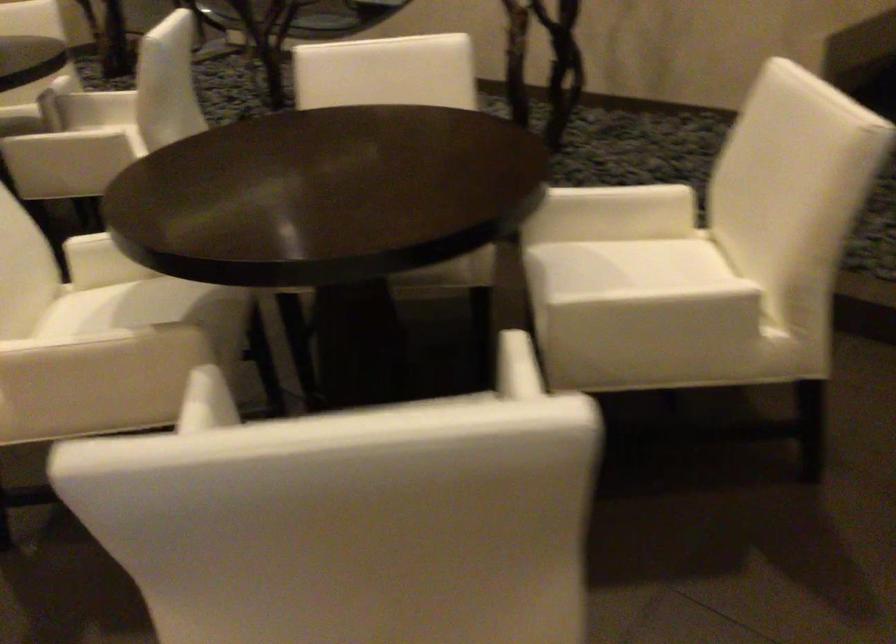
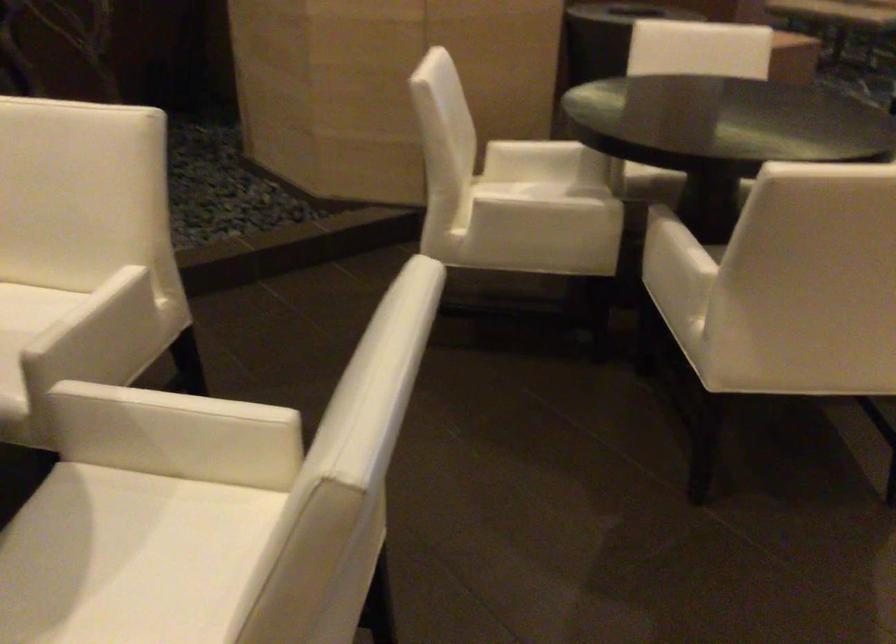
In the second image, find the point that corresponds to (668,270) in the first image.

(24, 308)